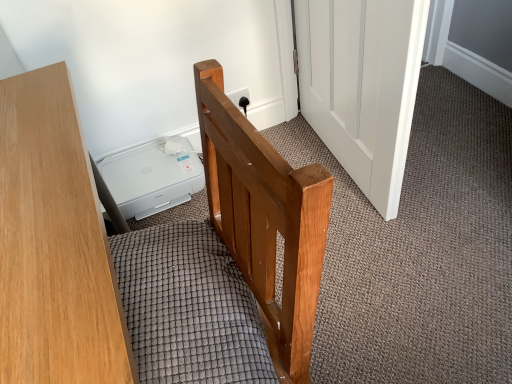
Where is `blank space above textured gray mattress at center (from a real-world perspective)`? The width and height of the screenshot is (512, 384). blank space above textured gray mattress at center (from a real-world perspective) is located at coordinates (172, 297).